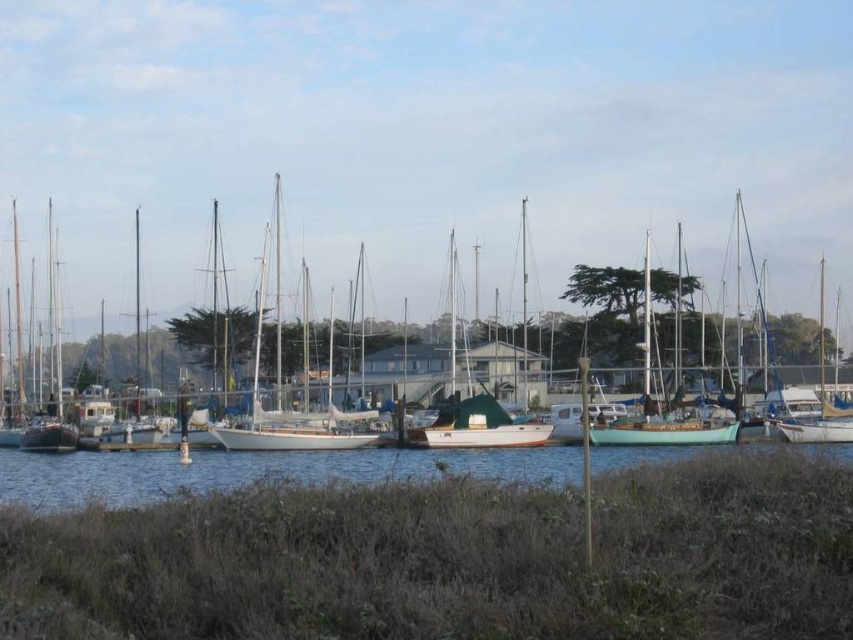
Which is more to the left, white wooden sailboat at center or blue water at lower center?

From the viewer's perspective, white wooden sailboat at center appears more on the left side.

Can you confirm if white wooden sailboat at center is positioned above blue water at lower center?

Yes.

Is point (44, 448) in front of point (7, 481)?

That is False.

In order to click on white wooden sailboat at center in this screenshot , I will do `click(277, 385)`.

Who is positioned more to the left, smooth white boat at center or white wooden sailboat at center?

white wooden sailboat at center is more to the left.

Is point (157, 588) farther from camera compared to point (404, 396)?

No, (157, 588) is in front of (404, 396).

You are a GUI agent. You are given a task and a screenshot of the screen. Output one action in this format:
    pyautogui.click(x=<x>, y=<y>)
    Task: Click on the smooth white boat at center
    
    Given the screenshot: What is the action you would take?
    pyautogui.click(x=451, y=560)

Which is more to the right, smooth white boat at center or blue water at lower center?

Positioned to the right is smooth white boat at center.

Which of these two, smooth white boat at center or blue water at lower center, stands shorter?

With less height is smooth white boat at center.

Which is in front, point (787, 452) or point (155, 458)?

Point (787, 452) is more forward.

Find the location of a particular element. The image size is (853, 640). smooth white boat at center is located at coordinates (451, 560).